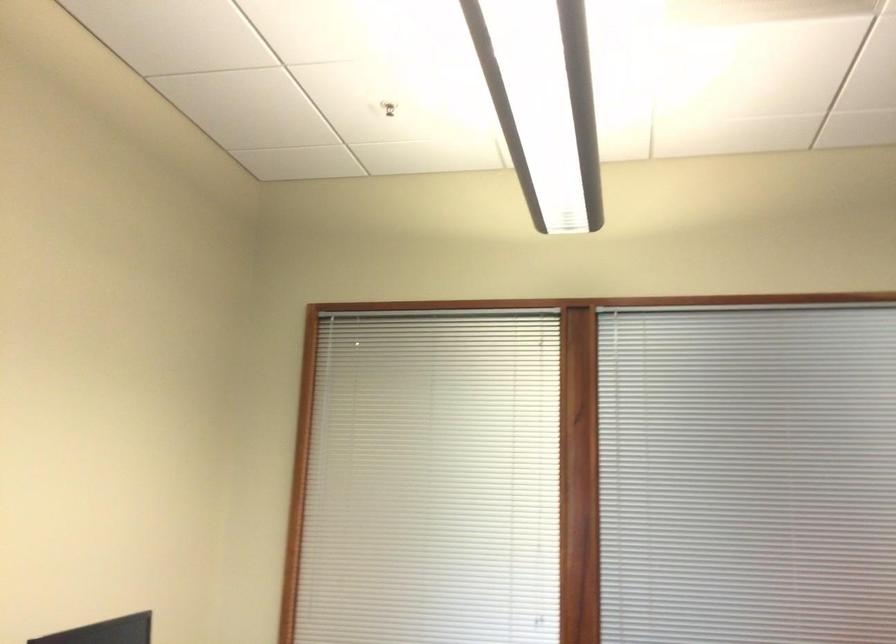
The width and height of the screenshot is (896, 644). Identify the location of window blind wand. (436, 313).